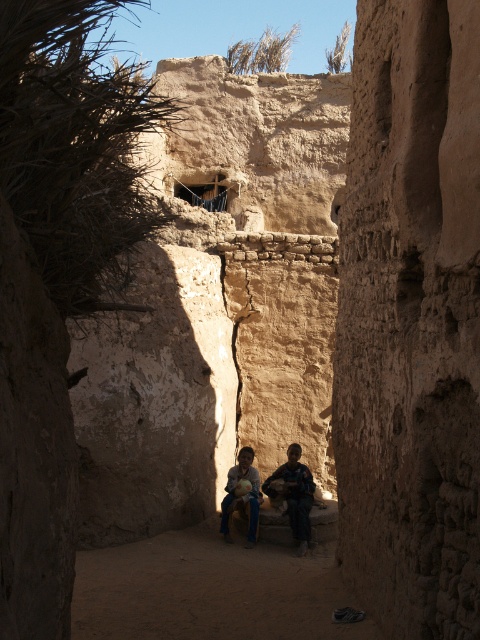
You are a delivery person with a cart that is 1.2 meters wide. You need to navigate through the narrow brown rough stone alley at center and the brown textured fabric at center. Can your cart pass through the space between them?

The distance between the brown rough stone alley at center and the brown textured fabric at center is 12.36 meters, so yes, the cart can pass through the space between them since it is wider than the cart.

You are a delivery person trying to navigate through the narrow alleyway. You notice a brown textured fabric at center and a matte brown child at center. Which object is shorter in height?

The brown textured fabric at center is shorter than the matte brown child at center.